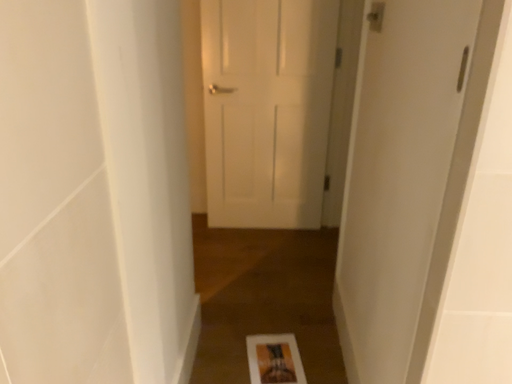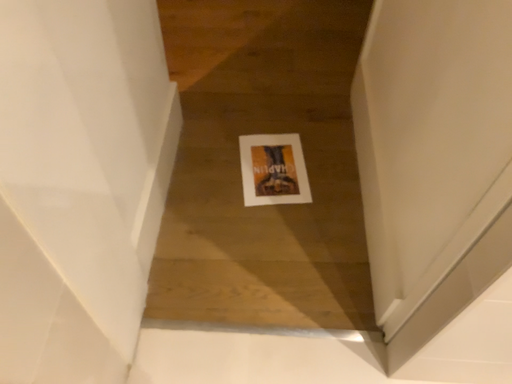
Question: How did the camera likely rotate when shooting the video?

Choices:
 (A) rotated upward
 (B) rotated downward

Answer: (B)